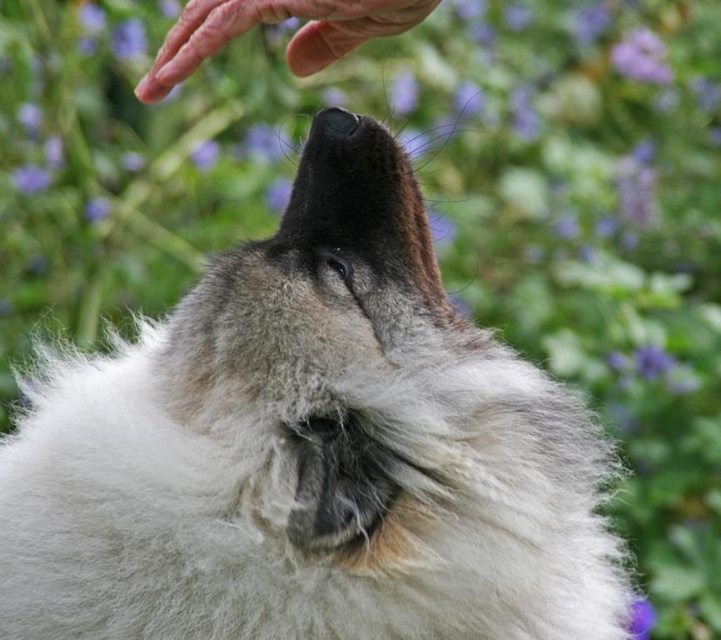
You are standing in a garden and want to reach the point marked at coordinates point (213, 52). If you can move forward 1 meter, will you be able to reach it?

The distance between point (213, 52) and the viewer is 1.10 meters. Since you can only move forward 1 meter, you will not be able to reach the point marked at coordinates point (213, 52).

You are a photographer trying to capture the dog and the purple matte flower at upper right. To avoid blocking the flower in the shot, where should you position the dry skin at upper center?

The dry skin at upper center is positioned under the purple matte flower at upper right, so to avoid blocking the flower, you should move the dry skin at upper center out from underneath it.

You are a veterinarian examining a dog and notice two objects in the image. One is the dry skin at upper center and the other is the purple matte flower at upper right. Based on their sizes, which object is more likely to block the dog from seeing the flower?

The dry skin at upper center might be wider than purple matte flower at upper right, so it could block the dog from seeing the flower if positioned between them.